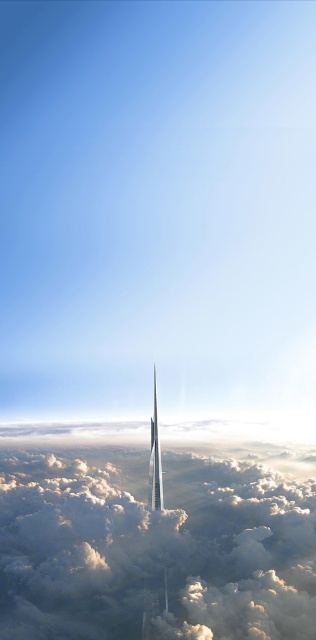
Does white fluffy cloud at center appear on the left side of shiny silver rocket at center?

Yes, white fluffy cloud at center is to the left of shiny silver rocket at center.

Does white fluffy cloud at center have a smaller size compared to shiny silver rocket at center?

No, white fluffy cloud at center is not smaller than shiny silver rocket at center.

Is point (242, 636) in front of point (158, 493)?

That is False.

Find the location of a particular element. This screenshot has width=316, height=640. white fluffy cloud at center is located at coordinates (152, 548).